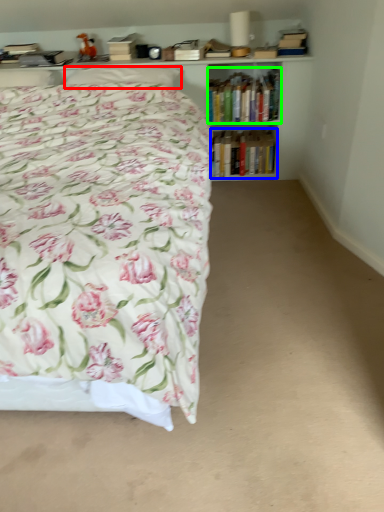
Question: Which object is the farthest from pillow (highlighted by a red box)? Choose among these: book (highlighted by a blue box) or book (highlighted by a green box).

Choices:
 (A) book
 (B) book

Answer: (A)